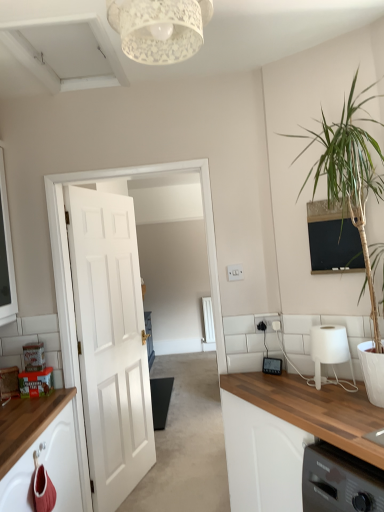
At what (x,y) coordinates should I click in order to perform the action: click on free point above white matte lamp at right (from a real-world perspective). Please return your answer as a coordinate pair (x, y). Image resolution: width=384 pixels, height=512 pixels. Looking at the image, I should click on (329, 329).